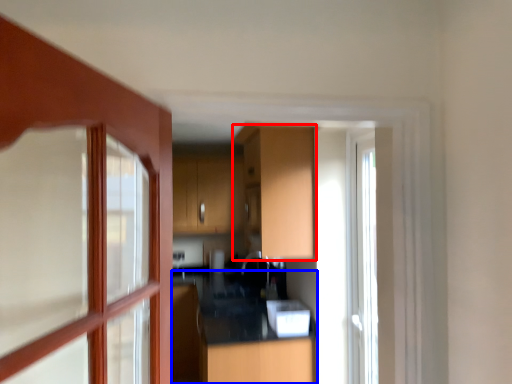
Question: Which object appears farthest to the camera in this image, cabinetry (highlighted by a red box) or counter top (highlighted by a blue box)?

Choices:
 (A) cabinetry
 (B) counter top

Answer: (B)